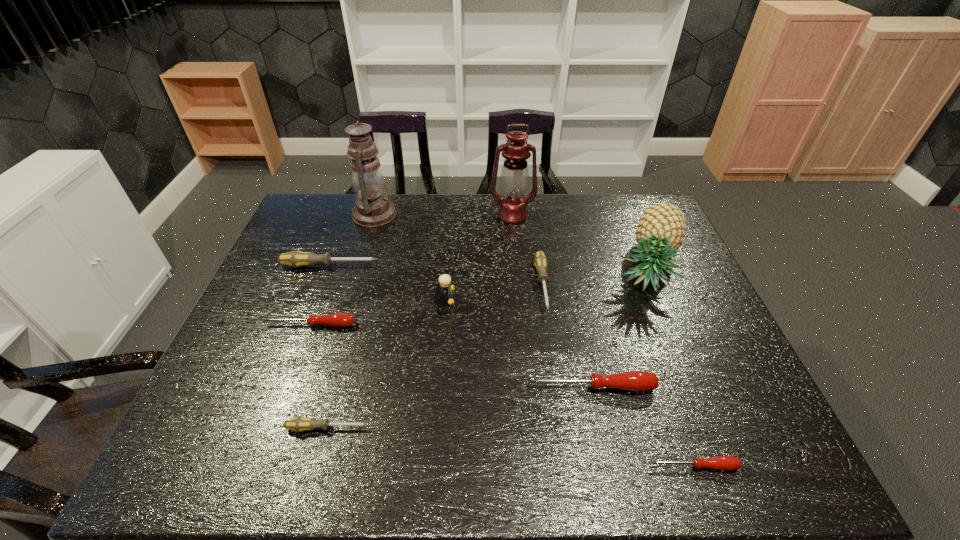
The height and width of the screenshot is (540, 960). What are the coordinates of `vacant region at the far edge of the desktop` in the screenshot? It's located at (492, 221).

What are the coordinates of `free space at the near edge of the desktop` in the screenshot? It's located at (420, 437).

Locate an element on the screen. The image size is (960, 540). vacant region at the left edge of the desktop is located at coordinates (309, 243).

Locate an element on the screen. This screenshot has width=960, height=540. vacant space at the right edge of the desktop is located at coordinates (715, 323).

At what (x,y) coordinates should I click in order to perform the action: click on free space at the near left corner of the desktop. Please return your answer as a coordinate pair (x, y). The image size is (960, 540). Looking at the image, I should click on click(176, 453).

Identify the location of free space at the near right corner. This screenshot has width=960, height=540. (711, 448).

The width and height of the screenshot is (960, 540). I want to click on vacant region between the fifth object from left to right and the biggest gray screwdriver, so click(387, 284).

Find the location of a particular element. unoccupied area between the smallest red screwdriver and the red oil lamp is located at coordinates (603, 341).

Find the location of a particular element. The height and width of the screenshot is (540, 960). unoccupied area between the farthest red screwdriver and the second biggest gray screwdriver is located at coordinates (426, 305).

I want to click on vacant area that lies between the third farthest screwdriver and the pineapple, so click(479, 295).